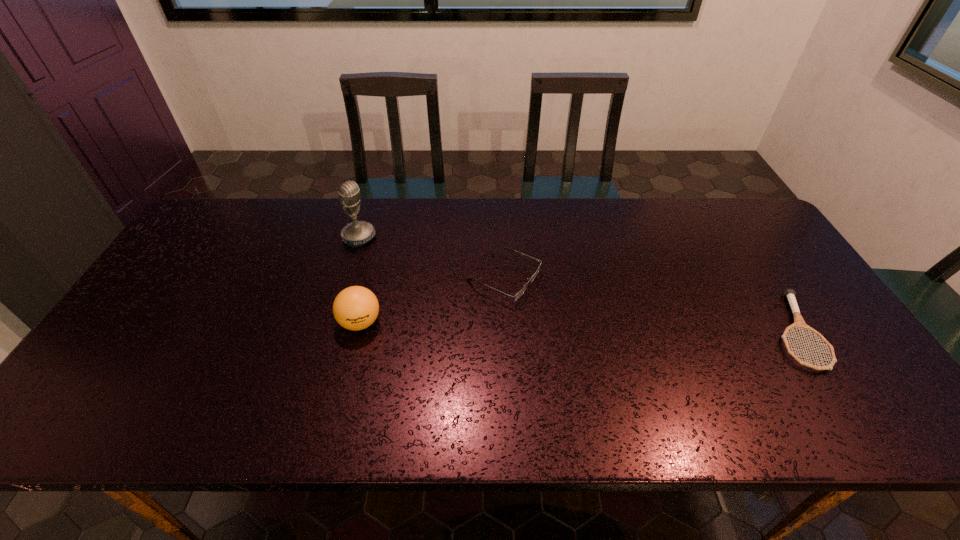
Where is `vacant space situated on the front-facing side of the microphone`? vacant space situated on the front-facing side of the microphone is located at coordinates (392, 256).

At what (x,y) coordinates should I click in order to perform the action: click on vacant space located 0.350m on the front-facing side of the microphone. Please return your answer as a coordinate pair (x, y). This screenshot has width=960, height=540. Looking at the image, I should click on (458, 294).

The image size is (960, 540). In order to click on blank space located on the front-facing side of the third object from left to right in this screenshot , I will do `click(570, 308)`.

Find the location of a particular element. Image resolution: width=960 pixels, height=540 pixels. blank area located 0.360m on the front-facing side of the third object from left to right is located at coordinates (668, 351).

At what (x,y) coordinates should I click in order to perform the action: click on vacant space positioned 0.060m on the front-facing side of the third object from left to right. Please return your answer as a coordinate pair (x, y). Looking at the image, I should click on (557, 302).

Find the location of a particular element. object at the far edge is located at coordinates (357, 233).

The height and width of the screenshot is (540, 960). Identify the location of object that is positioned at the near edge. (790, 294).

Where is `object present at the right edge`? This screenshot has height=540, width=960. object present at the right edge is located at coordinates (790, 294).

Locate an element on the screen. This screenshot has height=540, width=960. object present at the near right corner is located at coordinates (790, 294).

Locate an element on the screen. The image size is (960, 540). vacant space at the far edge of the desktop is located at coordinates (566, 210).